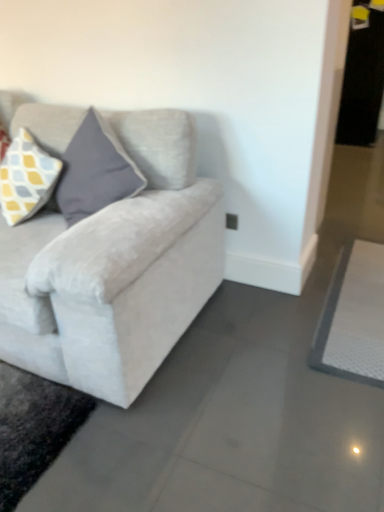
Question: Based on their positions, is yellow and gray checkered fabric pillow at upper left located to the left or right of white textured yoga mat at lower right?

Choices:
 (A) left
 (B) right

Answer: (A)

Question: Is yellow and gray checkered fabric pillow at upper left bigger or smaller than white textured yoga mat at lower right?

Choices:
 (A) big
 (B) small

Answer: (A)

Question: Which of these objects is positioned closest to the yellow and gray checkered fabric pillow at upper left?

Choices:
 (A) white textured yoga mat at lower right
 (B) velvet light gray couch at left

Answer: (B)

Question: Based on their relative distances, which object is farther from the yellow and gray checkered fabric pillow at upper left?

Choices:
 (A) white textured yoga mat at lower right
 (B) velvet light gray couch at left

Answer: (A)